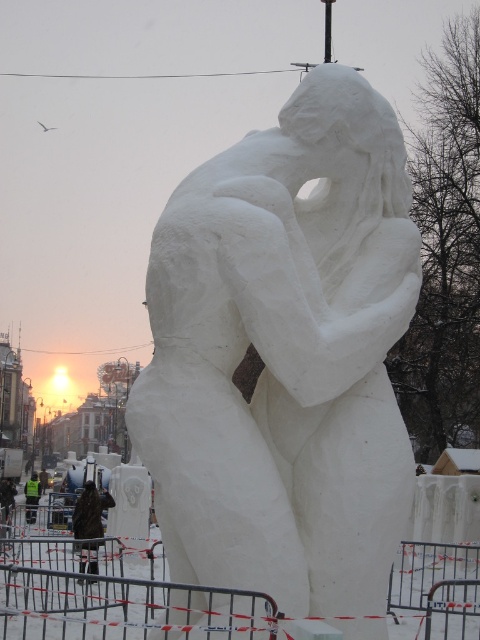
Who is positioned more to the right, white snow sculpture at center or brown fabric jacket at lower left?

white snow sculpture at center is more to the right.

How distant is white snow sculpture at center from brown fabric jacket at lower left?

23.21 meters

You are a GUI agent. You are given a task and a screenshot of the screen. Output one action in this format:
    pyautogui.click(x=<x>, y=<y>)
    Task: Click on the white snow sculpture at center
    
    Given the screenshot: What is the action you would take?
    pyautogui.click(x=285, y=355)

Is white snow sculpture at center smaller than green reflective vest at center?

Indeed, white snow sculpture at center has a smaller size compared to green reflective vest at center.

Which is in front, point (342, 144) or point (26, 509)?

Point (342, 144) is more forward.

Does point (367, 540) come in front of point (27, 504)?

Yes, point (367, 540) is closer to viewer.

The image size is (480, 640). Find the location of `white snow sculpture at center`. white snow sculpture at center is located at coordinates (285, 355).

Measure the distance between brown fabric jacket at lower left and green reflective vest at center.

A distance of 111.01 feet exists between brown fabric jacket at lower left and green reflective vest at center.

The image size is (480, 640). I want to click on brown fabric jacket at lower left, so click(90, 513).

What do you see at coordinates (90, 513) in the screenshot? The height and width of the screenshot is (640, 480). I see `brown fabric jacket at lower left` at bounding box center [90, 513].

Find the location of `brown fabric jacket at lower left`. brown fabric jacket at lower left is located at coordinates (90, 513).